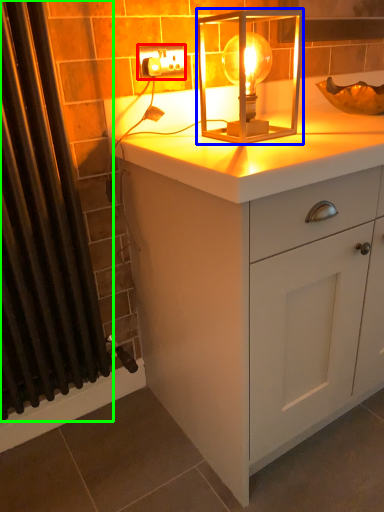
Question: Which is nearer to the electric outlet (highlighted by a red box)? lamp (highlighted by a blue box) or shower curtain (highlighted by a green box).

Choices:
 (A) lamp
 (B) shower curtain

Answer: (A)